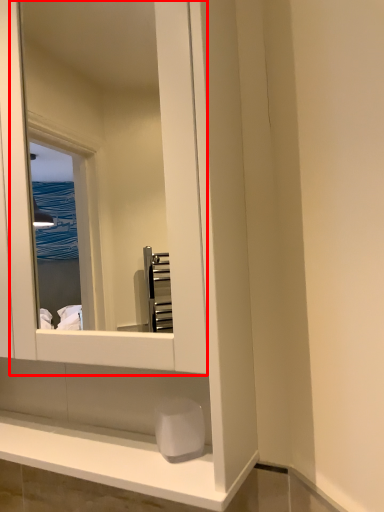
Question: From the image's perspective, where is mirror (annotated by the red box) located in relation to soap in the image?

Choices:
 (A) above
 (B) below

Answer: (A)